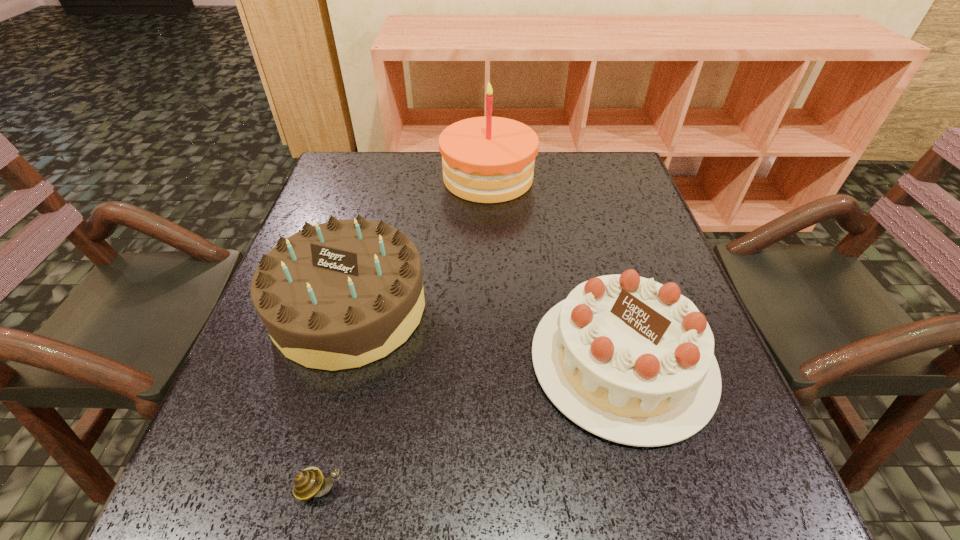
Where is `the farthest object`? This screenshot has height=540, width=960. the farthest object is located at coordinates (487, 159).

Where is `the tallest birthday cake`? The width and height of the screenshot is (960, 540). the tallest birthday cake is located at coordinates (487, 159).

At what (x,y) coordinates should I click in order to perform the action: click on the leftmost birthday cake. Please return your answer as a coordinate pair (x, y). The height and width of the screenshot is (540, 960). Looking at the image, I should click on (338, 295).

At what (x,y) coordinates should I click in order to perform the action: click on snail. Please return your answer as a coordinate pair (x, y). Looking at the image, I should click on (307, 484).

You are a GUI agent. You are given a task and a screenshot of the screen. Output one action in this format:
    pyautogui.click(x=<x>, y=<y>)
    Task: Click on the nearest object
    The image size is (960, 540).
    Given the screenshot: What is the action you would take?
    pyautogui.click(x=307, y=484)

At what (x,y) coordinates should I click in order to perform the action: click on vacant point located on the left of the tallest object. Please return your answer as a coordinate pair (x, y). Looking at the image, I should click on (348, 178).

Locate an element on the screen. free region located on the front-facing side of the leftmost birthday cake is located at coordinates (304, 472).

At what (x,y) coordinates should I click in order to perform the action: click on vacant area situated on the face of the snail. Please return your answer as a coordinate pair (x, y). Looking at the image, I should click on (406, 488).

The width and height of the screenshot is (960, 540). In order to click on object situated at the far edge in this screenshot , I will do `click(487, 159)`.

Locate an element on the screen. This screenshot has width=960, height=540. object that is at the near edge is located at coordinates (307, 484).